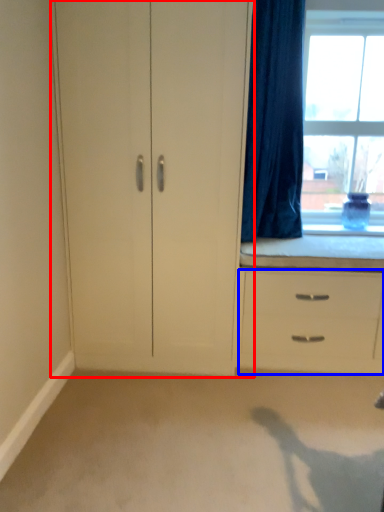
Question: Which object appears closest to the camera in this image, cupboard (highlighted by a red box) or chest of drawers (highlighted by a blue box)?

Choices:
 (A) cupboard
 (B) chest of drawers

Answer: (A)